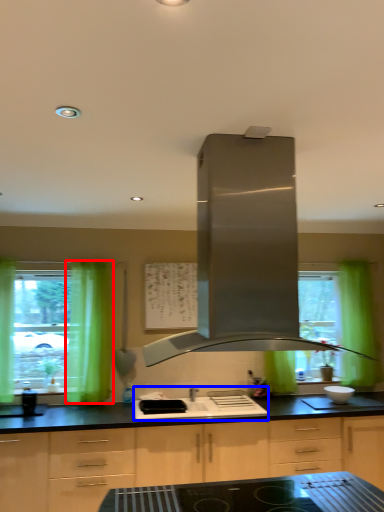
Question: Among these objects, which one is farthest to the camera, curtain (highlighted by a red box) or sink (highlighted by a blue box)?

Choices:
 (A) curtain
 (B) sink

Answer: (A)